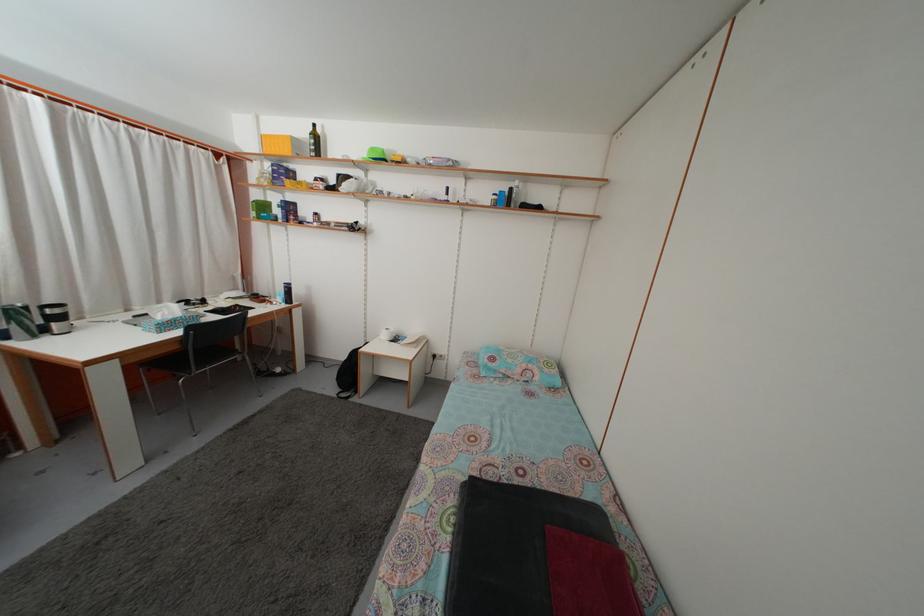
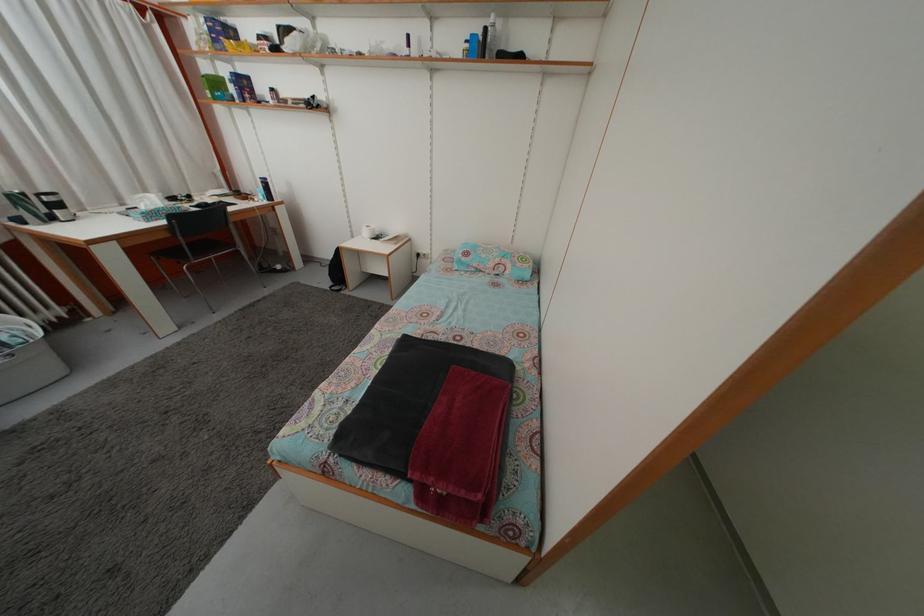
Find the pixel in the second image that matches point (134, 318) in the first image.

(128, 213)